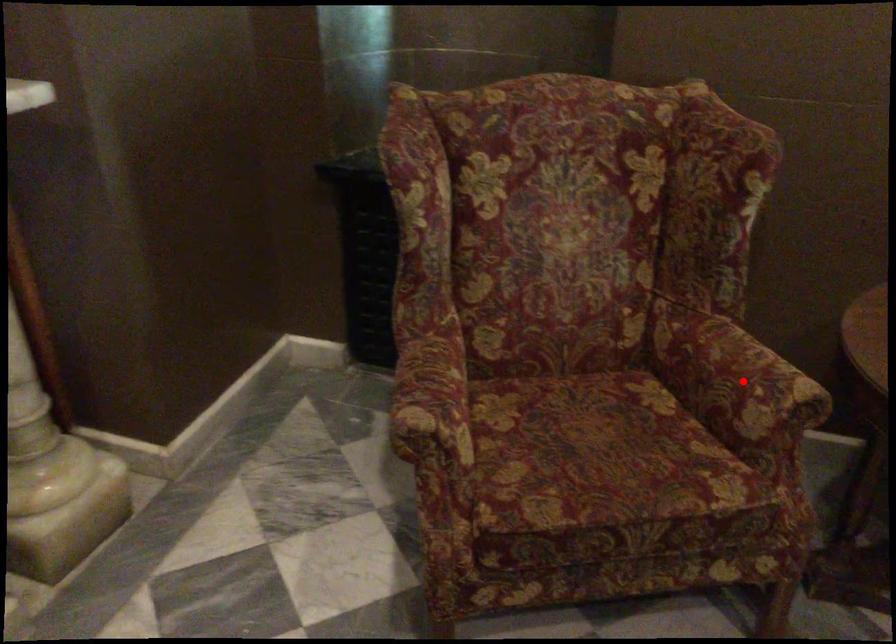
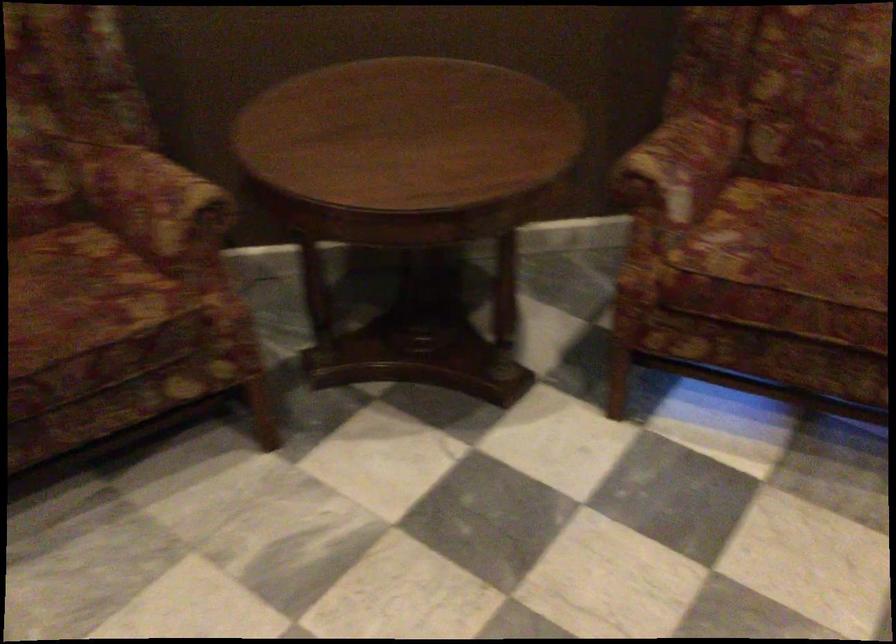
In the second image, find the point that corresponds to the highlighted location in the first image.

(156, 204)